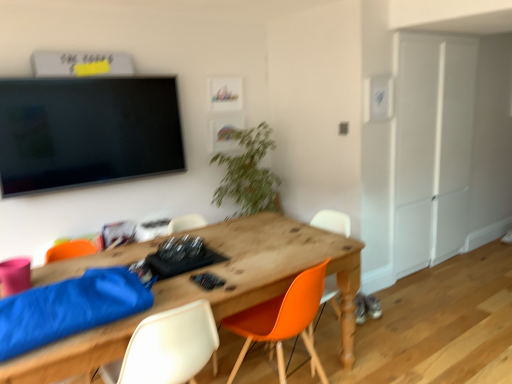
This screenshot has width=512, height=384. What do you see at coordinates (332, 221) in the screenshot?
I see `orange matte chair at center, the third chair from the left` at bounding box center [332, 221].

The width and height of the screenshot is (512, 384). Describe the element at coordinates (432, 147) in the screenshot. I see `white matte armoire at right` at that location.

Image resolution: width=512 pixels, height=384 pixels. Describe the element at coordinates (215, 291) in the screenshot. I see `wooden desk at center` at that location.

The height and width of the screenshot is (384, 512). Describe the element at coordinates (282, 320) in the screenshot. I see `orange plastic chair at center, which is the second chair in right-to-left order` at that location.

Measure the distance between white plastic chair at lower center, which ranks as the 3th chair in right-to-left order, and camera.

A distance of 4.98 feet exists between white plastic chair at lower center, which ranks as the 3th chair in right-to-left order, and camera.

Locate an element on the screen. orange matte chair at center, the third chair from the left is located at coordinates (332, 221).

Which of these two, white plastic chair at lower center, which is the 1th chair from left to right, or green leafy plant at center, stands taller?

green leafy plant at center is taller.

Which is farther, (137, 374) or (253, 132)?

Point (253, 132)

Is white plastic chair at lower center, which ranks as the 3th chair in right-to-left order, aimed at green leafy plant at center?

No, white plastic chair at lower center, which ranks as the 3th chair in right-to-left order, does not turn towards green leafy plant at center.

Is orange plastic chair at center, which is the second chair in right-to-left order, bigger than white matte armoire at right?

Incorrect, orange plastic chair at center, which is the second chair in right-to-left order, is not larger than white matte armoire at right.

From the image's perspective, who appears lower, orange plastic chair at center, which is the second chair in right-to-left order, or white matte armoire at right?

orange plastic chair at center, which is the second chair in right-to-left order, from the image's perspective.

Considering the sizes of objects orange plastic chair at center, which is the second chair from left to right, and white matte armoire at right in the image provided, who is thinner, orange plastic chair at center, which is the second chair from left to right, or white matte armoire at right?

white matte armoire at right.

How different are the orientations of white plastic chair at lower center, which is the 1th chair from left to right, and orange plastic chair at center, which is the second chair in right-to-left order, in degrees?

white plastic chair at lower center, which is the 1th chair from left to right, and orange plastic chair at center, which is the second chair in right-to-left order, are facing 17.6 degrees away from each other.

From the picture: Which object is thinner, white plastic chair at lower center, which ranks as the 3th chair in right-to-left order, or orange plastic chair at center, which is the second chair in right-to-left order?

With smaller width is white plastic chair at lower center, which ranks as the 3th chair in right-to-left order.

Which object is closer to the camera, white plastic chair at lower center, which ranks as the 3th chair in right-to-left order, or orange plastic chair at center, which is the second chair from left to right?

white plastic chair at lower center, which ranks as the 3th chair in right-to-left order.

Considering the positions of objects wooden desk at center and orange matte chair at center, placed as the 1th chair when sorted from right to left, in the image provided, who is in front, wooden desk at center or orange matte chair at center, placed as the 1th chair when sorted from right to left,?

wooden desk at center is closer to the camera.

Locate an element on the screen. This screenshot has height=384, width=512. desk in front of the orange matte chair at center, the third chair from the left is located at coordinates (215, 291).

Which object is wider, wooden desk at center or orange matte chair at center, placed as the 1th chair when sorted from right to left?

Wider between the two is wooden desk at center.

From the image's perspective, is white matte armoire at right located above or below wooden desk at center?

Based on their image positions, white matte armoire at right is located above wooden desk at center.

What's the angular difference between white matte armoire at right and wooden desk at center's facing directions?

The facing directions of white matte armoire at right and wooden desk at center are 1.46 degrees apart.

Considering the relative positions of white matte armoire at right and wooden desk at center in the image provided, is white matte armoire at right to the right of wooden desk at center from the viewer's perspective?

Indeed, white matte armoire at right is positioned on the right side of wooden desk at center.

Is white matte armoire at right looking in the opposite direction of wooden desk at center?

white matte armoire at right does not have its back to wooden desk at center.

Is there a large distance between orange matte chair at center, the third chair from the left, and orange plastic chair at center, which is the second chair from left to right?

Yes, orange matte chair at center, the third chair from the left, is far from orange plastic chair at center, which is the second chair from left to right.

Could orange plastic chair at center, which is the second chair in right-to-left order, be considered to be inside orange matte chair at center, placed as the 1th chair when sorted from right to left?

No, orange plastic chair at center, which is the second chair in right-to-left order, is located outside of orange matte chair at center, placed as the 1th chair when sorted from right to left.

Does orange matte chair at center, the third chair from the left, have a lesser width compared to orange plastic chair at center, which is the second chair from left to right?

Correct, the width of orange matte chair at center, the third chair from the left, is less than that of orange plastic chair at center, which is the second chair from left to right.

Consider the image. Is orange matte chair at center, placed as the 1th chair when sorted from right to left, closer to the viewer compared to orange plastic chair at center, which is the second chair in right-to-left order?

No, orange matte chair at center, placed as the 1th chair when sorted from right to left, is further to the viewer.

Does point (254, 275) come closer to viewer compared to point (428, 226)?

Yes, point (254, 275) is in front of point (428, 226).

Does wooden desk at center have a lesser height compared to white matte armoire at right?

Indeed, wooden desk at center has a lesser height compared to white matte armoire at right.

Who is bigger, wooden desk at center or white matte armoire at right?

Bigger between the two is wooden desk at center.

Are wooden desk at center and white matte armoire at right making contact?

There is a gap between wooden desk at center and white matte armoire at right.

From a real-world perspective, which chair is the 1st one underneath the green leafy plant at center? Please provide its 2D coordinates.

[(169, 347)]

You are a GUI agent. You are given a task and a screenshot of the screen. Output one action in this format:
    pyautogui.click(x=<x>, y=<y>)
    Task: Click on the armoire on the right of orange plastic chair at center, which is the second chair in right-to-left order
    
    Given the screenshot: What is the action you would take?
    pyautogui.click(x=432, y=147)

From the image, which object appears to be nearer to orange matte chair at center, placed as the 1th chair when sorted from right to left, green leafy plant at center or orange plastic chair at center, which is the second chair from left to right?

Among the two, green leafy plant at center is located nearer to orange matte chair at center, placed as the 1th chair when sorted from right to left.

Estimate the real-world distances between objects in this image. Which object is further from white plastic chair at lower center, which is the 1th chair from left to right, green leafy plant at center or orange matte chair at center, the third chair from the left?

green leafy plant at center is positioned further to the anchor white plastic chair at lower center, which is the 1th chair from left to right.

Estimate the real-world distances between objects in this image. Which object is further from wooden desk at center, orange matte chair at center, placed as the 1th chair when sorted from right to left, or green leafy plant at center?

orange matte chair at center, placed as the 1th chair when sorted from right to left.

Based on their spatial positions, is orange plastic chair at center, which is the second chair from left to right, or green leafy plant at center further from white matte armoire at right?

Based on the image, orange plastic chair at center, which is the second chair from left to right, appears to be further to white matte armoire at right.

When comparing their distances from white plastic chair at lower center, which ranks as the 3th chair in right-to-left order, does white matte armoire at right or orange matte chair at center, the third chair from the left, seem closer?

orange matte chair at center, the third chair from the left, lies closer to white plastic chair at lower center, which ranks as the 3th chair in right-to-left order, than the other object.

Looking at the image, which one is located further to white matte armoire at right, orange matte chair at center, placed as the 1th chair when sorted from right to left, or orange plastic chair at center, which is the second chair from left to right?

orange plastic chair at center, which is the second chair from left to right, lies further to white matte armoire at right than the other object.

Considering their positions, is white plastic chair at lower center, which ranks as the 3th chair in right-to-left order, positioned further to white matte armoire at right than orange plastic chair at center, which is the second chair in right-to-left order?

white plastic chair at lower center, which ranks as the 3th chair in right-to-left order.

From the image, which object appears to be nearer to white matte armoire at right, wooden desk at center or green leafy plant at center?

green leafy plant at center is closer to white matte armoire at right.

The image size is (512, 384). I want to click on desk between white plastic chair at lower center, which is the 1th chair from left to right, and orange plastic chair at center, which is the second chair from left to right, in the horizontal direction, so click(215, 291).

This screenshot has height=384, width=512. What are the coordinates of `chair between orange plastic chair at center, which is the second chair in right-to-left order, and green leafy plant at center from front to back` in the screenshot? It's located at (332, 221).

Identify the location of houseplant located between wooden desk at center and white matte armoire at right in the depth direction. The height and width of the screenshot is (384, 512). (249, 174).

Locate an element on the screen. chair located between white plastic chair at lower center, which is the 1th chair from left to right, and orange matte chair at center, the third chair from the left, in the depth direction is located at coordinates (282, 320).